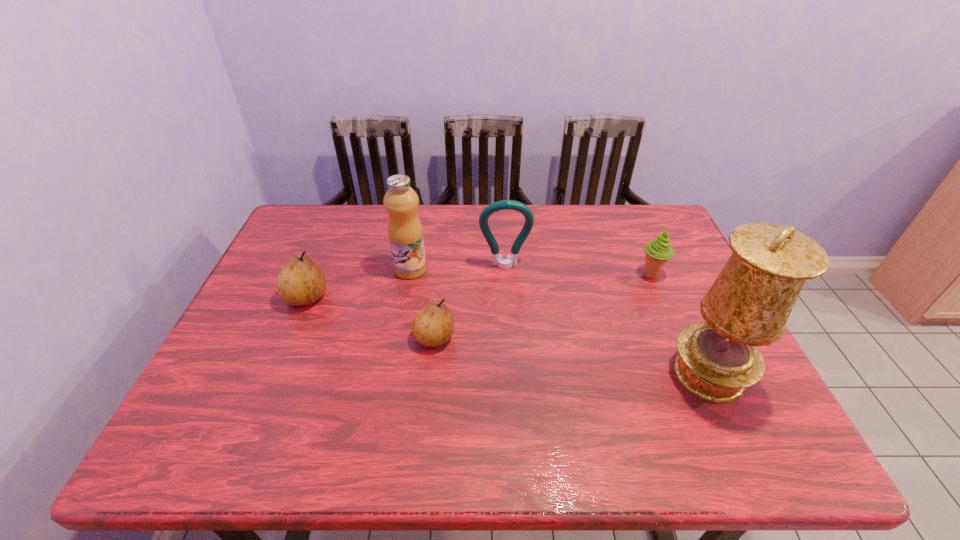
This screenshot has width=960, height=540. What are the coordinates of `vacant region between the nearer pear and the third tallest object` in the screenshot? It's located at (469, 302).

You are a GUI agent. You are given a task and a screenshot of the screen. Output one action in this format:
    pyautogui.click(x=<x>, y=<y>)
    Task: Click on the free area in between the bottle opener and the icecream
    The width and height of the screenshot is (960, 540).
    Given the screenshot: What is the action you would take?
    pyautogui.click(x=578, y=271)

Find the location of a particular element. The height and width of the screenshot is (540, 960). vacant region between the farther pear and the fifth shortest object is located at coordinates (358, 284).

The width and height of the screenshot is (960, 540). In order to click on free space that is in between the fourth object from left to right and the fifth shortest object in this screenshot , I will do `click(458, 268)`.

The image size is (960, 540). I want to click on free spot between the second tallest object and the fourth object from left to right, so click(458, 268).

I want to click on vacant point located between the taller pear and the shorter pear, so click(x=371, y=318).

Locate an element on the screen. object that ranks as the second closest to the icecream is located at coordinates (497, 260).

Locate an element on the screen. This screenshot has width=960, height=540. object that is the closest one to the left pear is located at coordinates (405, 232).

Find the location of a particular element. The image size is (960, 540). vacant region that satisfies the following two spatial constraints: 1. on the front label of the fruit juice; 2. on the right side of the icecream is located at coordinates (410, 275).

Identify the location of free space that satisfies the following two spatial constraints: 1. at the jaws of the bottle opener; 2. on the left side of the oil lamp. (512, 374).